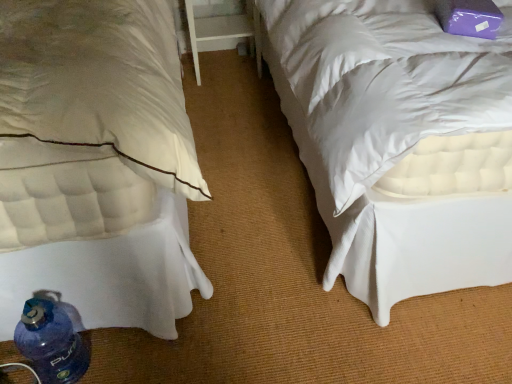
What do you see at coordinates (96, 163) in the screenshot?
I see `white quilted mattress at lower left` at bounding box center [96, 163].

Locate an element on the screen. The image size is (512, 384). blue plastic bottle at lower left is located at coordinates (51, 343).

From the image's perspective, is blue plastic bottle at lower left below white wood table at center?

Yes, from the image's perspective, blue plastic bottle at lower left is below white wood table at center.

From a real-world perspective, between blue plastic bottle at lower left and white wood table at center, who is vertically higher?

In real-world perspective, white wood table at center is above.

In the image, is blue plastic bottle at lower left on the left side or the right side of white wood table at center?

From the image, it's evident that blue plastic bottle at lower left is to the left of white wood table at center.

Does point (54, 371) lie in front of point (206, 39)?

Yes, point (54, 371) is closer to viewer.

Does point (109, 198) come in front of point (198, 67)?

Yes, point (109, 198) is closer to viewer.

Considering the sizes of white quilted mattress at lower left and white wood table at center in the image, is white quilted mattress at lower left taller or shorter than white wood table at center?

Clearly, white quilted mattress at lower left is taller compared to white wood table at center.

Image resolution: width=512 pixels, height=384 pixels. What are the coordinates of `table below the white quilted mattress at lower left (from a real-world perspective)` in the screenshot? It's located at (222, 31).

Is white quilted mattress at lower left positioned behind white wood table at center?

No.

Visually, is blue plastic bottle at lower left positioned to the left or to the right of white quilted mattress at lower left?

From the image, it's evident that blue plastic bottle at lower left is to the right of white quilted mattress at lower left.

Is white quilted mattress at lower left completely or partially inside blue plastic bottle at lower left?

Actually, white quilted mattress at lower left is outside blue plastic bottle at lower left.

Who is more distant, blue plastic bottle at lower left or white quilted mattress at lower left?

blue plastic bottle at lower left is further away from the camera.

Is blue plastic bottle at lower left taller or shorter than white quilted mattress at lower left?

blue plastic bottle at lower left is shorter than white quilted mattress at lower left.

Measure the distance from white wood table at center to blue plastic bottle at lower left.

white wood table at center is 6.17 feet away from blue plastic bottle at lower left.

Considering the sizes of objects white wood table at center and blue plastic bottle at lower left in the image provided, who is taller, white wood table at center or blue plastic bottle at lower left?

white wood table at center is taller.

Is white wood table at center directly adjacent to blue plastic bottle at lower left?

No, white wood table at center is not beside blue plastic bottle at lower left.

Between white wood table at center and blue plastic bottle at lower left, which one has larger width?

white wood table at center.

From the image's perspective, is white quilted mattress at lower left positioned above or below blue plastic bottle at lower left?

white quilted mattress at lower left is above blue plastic bottle at lower left.

Is white quilted mattress at lower left with blue plastic bottle at lower left?

No, white quilted mattress at lower left is not with blue plastic bottle at lower left.

Is white quilted mattress at lower left positioned in front of blue plastic bottle at lower left?

Yes, the depth of white quilted mattress at lower left is less than that of blue plastic bottle at lower left.

Which of these two, white quilted mattress at lower left or blue plastic bottle at lower left, is smaller?

blue plastic bottle at lower left is smaller.

From a real-world perspective, which is physically below, white wood table at center or white quilted mattress at lower left?

white wood table at center.

Which object is more forward, white wood table at center or white quilted mattress at lower left?

Positioned in front is white quilted mattress at lower left.

From the image's perspective, is white wood table at center above white quilted mattress at lower left?

Correct, white wood table at center appears higher than white quilted mattress at lower left in the image.

The image size is (512, 384). I want to click on bottle in front of the white wood table at center, so click(x=51, y=343).

Identify the location of table above the white quilted mattress at lower left (from the image's perspective). (222, 31).

When comparing their distances from white quilted mattress at lower left, does white wood table at center or blue plastic bottle at lower left seem closer?

blue plastic bottle at lower left is positioned closer to the anchor white quilted mattress at lower left.

Which object lies further to the anchor point blue plastic bottle at lower left, white wood table at center or white quilted mattress at lower left?

white wood table at center is positioned further to the anchor blue plastic bottle at lower left.

Estimate the real-world distances between objects in this image. Which object is closer to white wood table at center, blue plastic bottle at lower left or white quilted mattress at lower left?

Among the two, white quilted mattress at lower left is located nearer to white wood table at center.

When comparing their distances from blue plastic bottle at lower left, does white quilted mattress at lower left or white wood table at center seem closer?

Among the two, white quilted mattress at lower left is located nearer to blue plastic bottle at lower left.

Which object lies nearer to the anchor point white quilted mattress at lower left, blue plastic bottle at lower left or white wood table at center?

blue plastic bottle at lower left lies closer to white quilted mattress at lower left than the other object.

Which object lies further to the anchor point white wood table at center, white quilted mattress at lower left or blue plastic bottle at lower left?

The object further to white wood table at center is blue plastic bottle at lower left.

You are a GUI agent. You are given a task and a screenshot of the screen. Output one action in this format:
    pyautogui.click(x=<x>, y=<y>)
    Task: Click on the bottle between white quilted mattress at lower left and white wood table at center along the z-axis
    
    Given the screenshot: What is the action you would take?
    pyautogui.click(x=51, y=343)